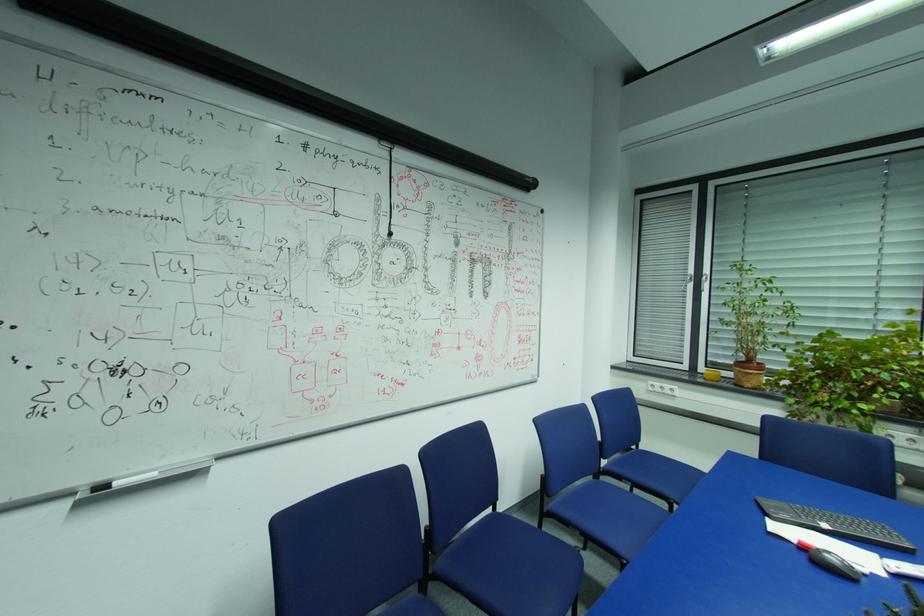
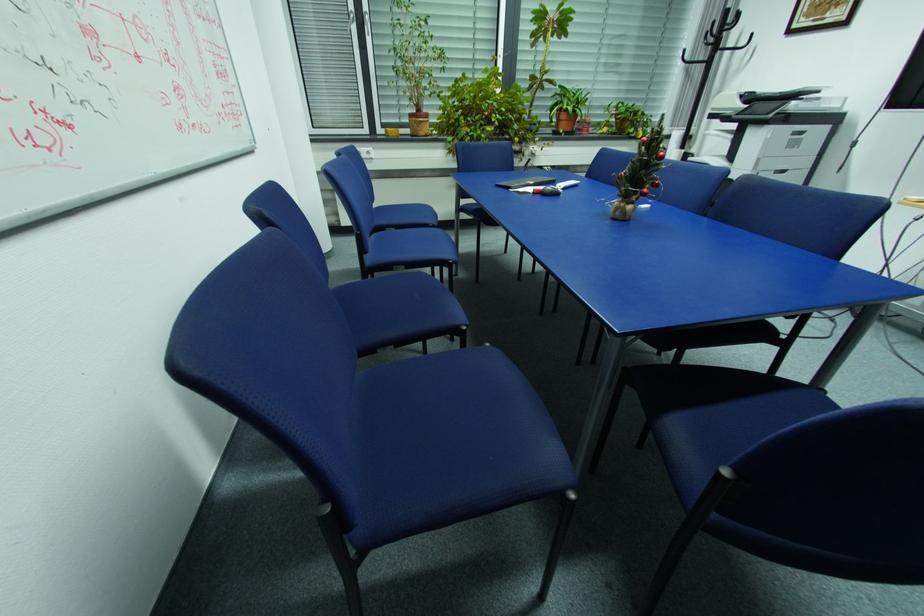
How did the camera likely rotate?

The camera's rotation is toward right-down.